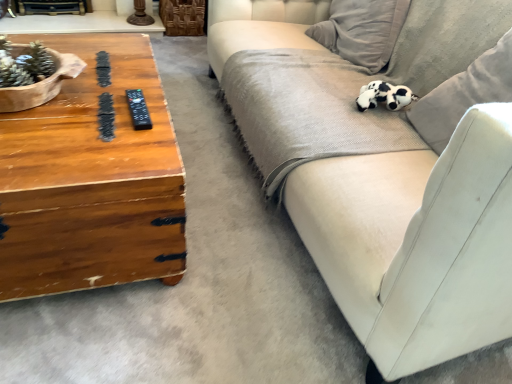
Question: From a real-world perspective, is black and white plush toy at upper right above or below woodenmaterial/texturecoffee table at left?

Choices:
 (A) above
 (B) below

Answer: (A)

Question: From the image's perspective, is black and white plush toy at upper right located above or below woodenmaterial/texturecoffee table at left?

Choices:
 (A) above
 (B) below

Answer: (A)

Question: Which object is the closest to the woodenmaterial/texturecoffee table at left?

Choices:
 (A) black and white plush toy at upper right
 (B) velvet beige couch at right
 (C) black plastic remote at left

Answer: (C)

Question: Which is farther from the black plastic remote at left?

Choices:
 (A) woodenmaterial/texturecoffee table at left
 (B) black and white plush toy at upper right
 (C) velvet beige couch at right

Answer: (B)